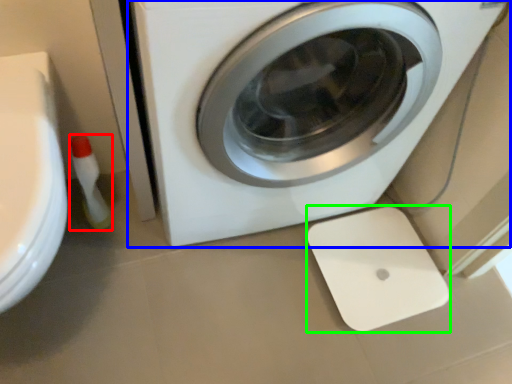
Question: Which object is positioned farthest from cleaning product (highlighted by a red box)? Select from washing machine (highlighted by a blue box) and appliance (highlighted by a green box).

Choices:
 (A) washing machine
 (B) appliance

Answer: (B)